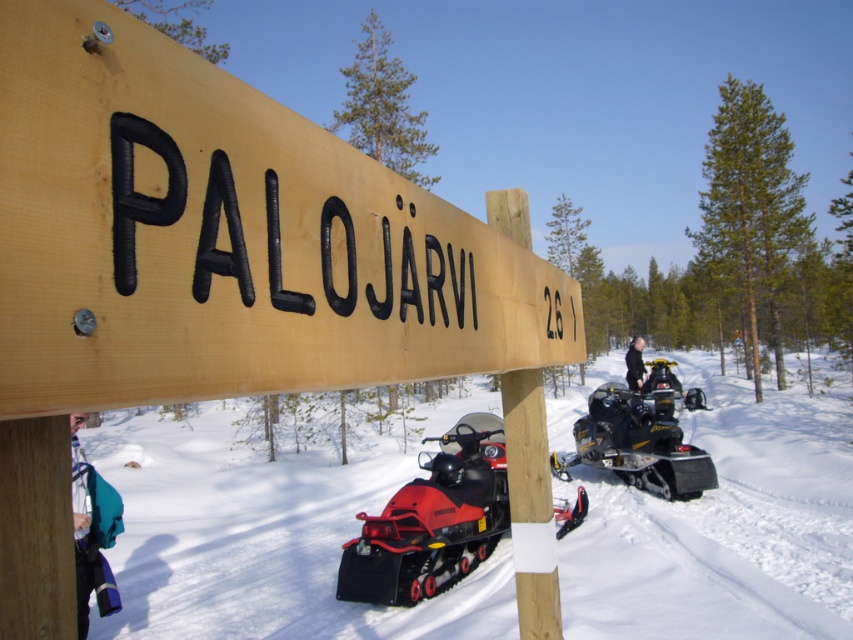
Question: Is red matte snowmobile at center closer to the viewer compared to blue fabric backpack at lower left?

Choices:
 (A) yes
 (B) no

Answer: (B)

Question: Which point is farther to the camera?

Choices:
 (A) (73, 104)
 (B) (360, 556)
 (C) (636, 349)

Answer: (C)

Question: Which object is positioned farthest from the red matte snowmobile at center?

Choices:
 (A) black rubber snowmobile at center
 (B) blue fabric backpack at lower left
 (C) wooden sign at upper left

Answer: (A)

Question: Can you confirm if white powdery snow at lower center is smaller than black matte jacket at center?

Choices:
 (A) yes
 (B) no

Answer: (B)

Question: Which point is closer to the camera?

Choices:
 (A) black matte jacket at center
 (B) red matte snowmobile at center
 (C) black rubber snowmobile at center

Answer: (B)

Question: Can you confirm if black rubber snowmobile at center is positioned to the left of blue fabric backpack at lower left?

Choices:
 (A) yes
 (B) no

Answer: (B)